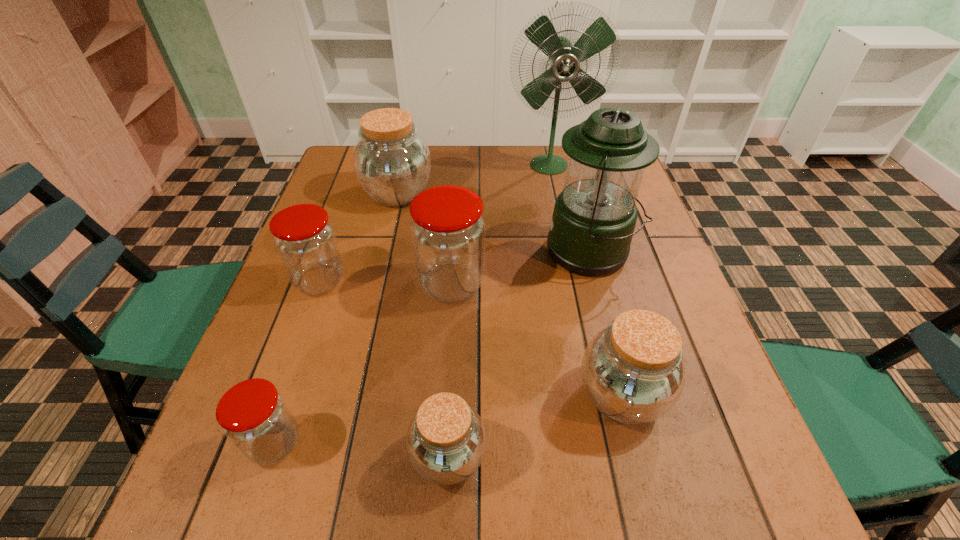
In the image, there is a desktop. At what (x,y) coordinates should I click in order to perform the action: click on free region at the right edge. Please return your answer as a coordinate pair (x, y). Image resolution: width=960 pixels, height=540 pixels. Looking at the image, I should click on (609, 288).

The height and width of the screenshot is (540, 960). Identify the location of vacant space at the far left corner. (347, 160).

Find the location of a particular element. vacant space at the near left corner of the desktop is located at coordinates (204, 479).

The height and width of the screenshot is (540, 960). I want to click on free space between the rightmost jar and the farthest brown jar, so coord(510,294).

I want to click on free space between the green fan and the second smallest brown jar, so click(586, 280).

Locate an element on the screen. The width and height of the screenshot is (960, 540). vacant space that's between the biggest red jar and the nearest red jar is located at coordinates pos(363,363).

The image size is (960, 540). Find the location of `free space between the biggest red jar and the nearest red jar`. free space between the biggest red jar and the nearest red jar is located at coordinates (363, 363).

In order to click on free space between the lantern and the second brown jar from right to left in this screenshot , I will do `click(519, 354)`.

Identify the location of unoccupied area between the second biggest red jar and the rightmost jar. This screenshot has height=540, width=960. (470, 338).

Find the location of a particular element. Image resolution: width=960 pixels, height=540 pixels. vacant area between the green fan and the biggest red jar is located at coordinates (500, 224).